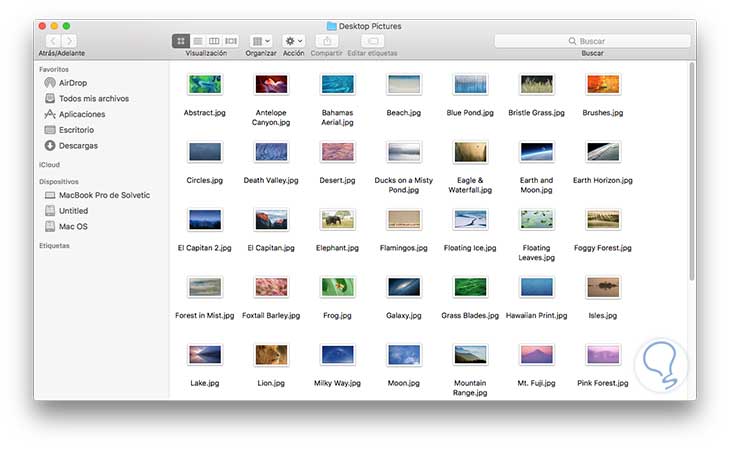
In order to click on columns in this screenshot , I will do `click(206, 76)`, `click(263, 78)`, `click(320, 80)`, `click(410, 82)`, `click(488, 81)`, `click(549, 82)`, `click(617, 84)`.